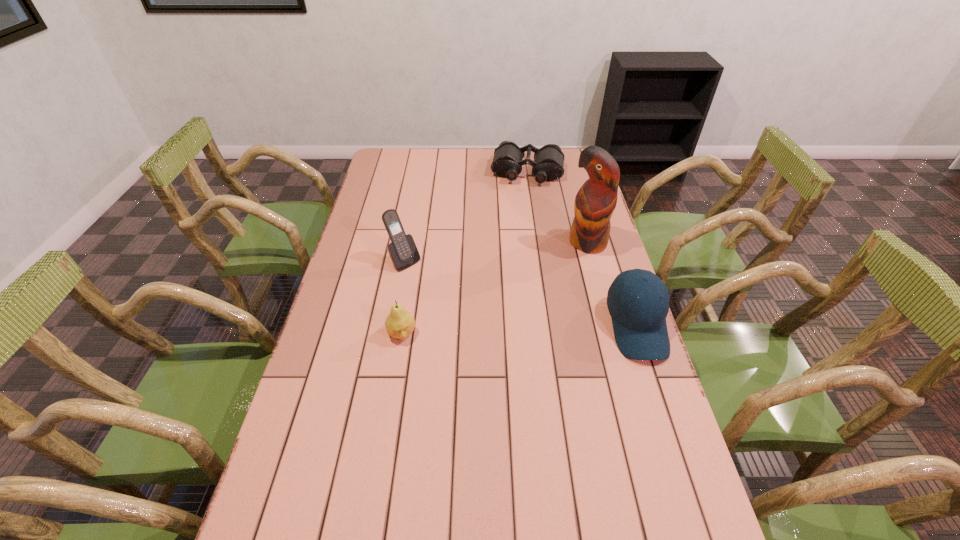
Find the location of a particular element. Image resolution: width=960 pixels, height=540 pixels. vacant space located 0.390m on the front-facing side of the second tallest object is located at coordinates [x=496, y=341].

The height and width of the screenshot is (540, 960). What are the coordinates of `vacant space located on the face of the parrot` in the screenshot? It's located at (513, 328).

Locate an element on the screen. free location located on the face of the parrot is located at coordinates (543, 294).

In order to click on free space located on the face of the parrot in this screenshot , I will do `click(563, 273)`.

Where is `free space located through the eyepieces of the binoculars`? This screenshot has width=960, height=540. free space located through the eyepieces of the binoculars is located at coordinates (520, 215).

Identify the location of free space located through the eyepieces of the binoculars. The width and height of the screenshot is (960, 540). (516, 252).

The height and width of the screenshot is (540, 960). What are the coordinates of `vacant space situated through the eyepieces of the binoculars` in the screenshot? It's located at (523, 195).

Image resolution: width=960 pixels, height=540 pixels. I want to click on object located at the far edge, so click(548, 165).

Identify the location of object located in the left edge section of the desktop. Image resolution: width=960 pixels, height=540 pixels. (402, 250).

This screenshot has width=960, height=540. In order to click on baseball cap that is at the right edge in this screenshot , I will do `click(639, 324)`.